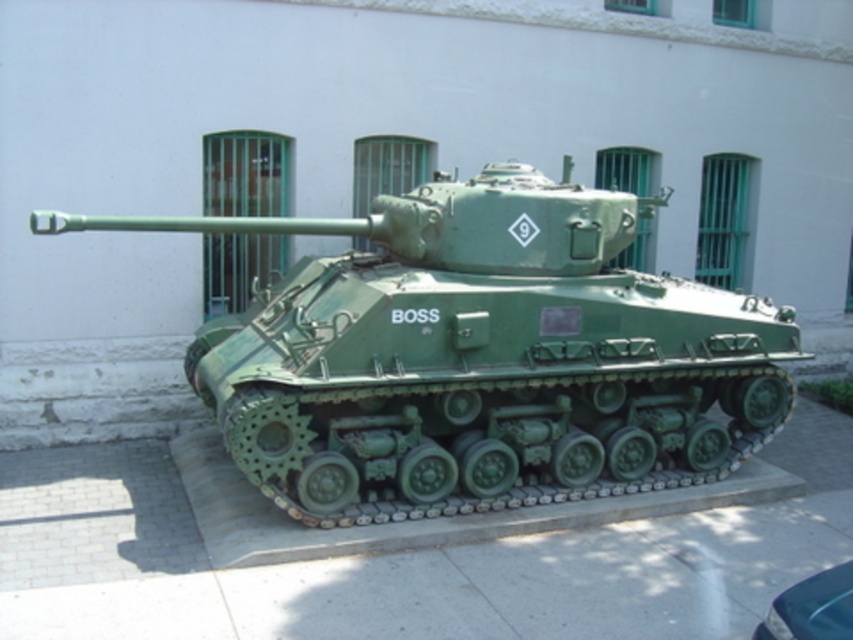
Does green matte tank at center have a larger size compared to green rubber tracks at lower center?

Yes.

Is green matte tank at center to the left of green rubber tracks at lower center from the viewer's perspective?

No, green matte tank at center is not to the left of green rubber tracks at lower center.

This screenshot has height=640, width=853. What do you see at coordinates (479, 356) in the screenshot?
I see `green matte tank at center` at bounding box center [479, 356].

Identify the location of green matte tank at center. pyautogui.click(x=479, y=356).

Between green rubber tracks at lower center and shiny black car at lower right, which one is positioned higher?

green rubber tracks at lower center

In the scene shown: Is the position of green rubber tracks at lower center less distant than that of shiny black car at lower right?

No, green rubber tracks at lower center is further to the viewer.

Who is more forward, (289, 522) or (773, 600)?

Point (773, 600)

Identify the location of green rubber tracks at lower center. This screenshot has width=853, height=640. (422, 516).

In the scene shown: Between green matte tank at center and shiny black car at lower right, which one appears on the right side from the viewer's perspective?

From the viewer's perspective, shiny black car at lower right appears more on the right side.

Can you confirm if green matte tank at center is thinner than shiny black car at lower right?

In fact, green matte tank at center might be wider than shiny black car at lower right.

What are the coordinates of `green matte tank at center` in the screenshot? It's located at tap(479, 356).